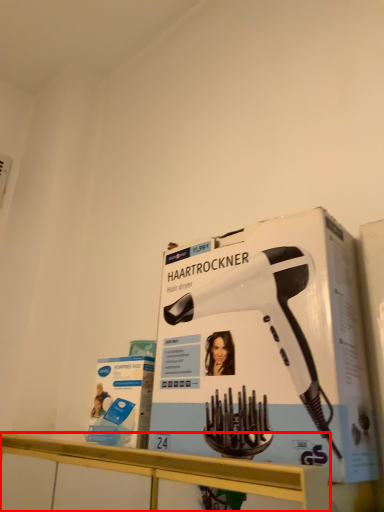
Question: From the image's perspective, what is the correct spatial positioning of counter (annotated by the red box) in reference to hair drier?

Choices:
 (A) above
 (B) below

Answer: (B)